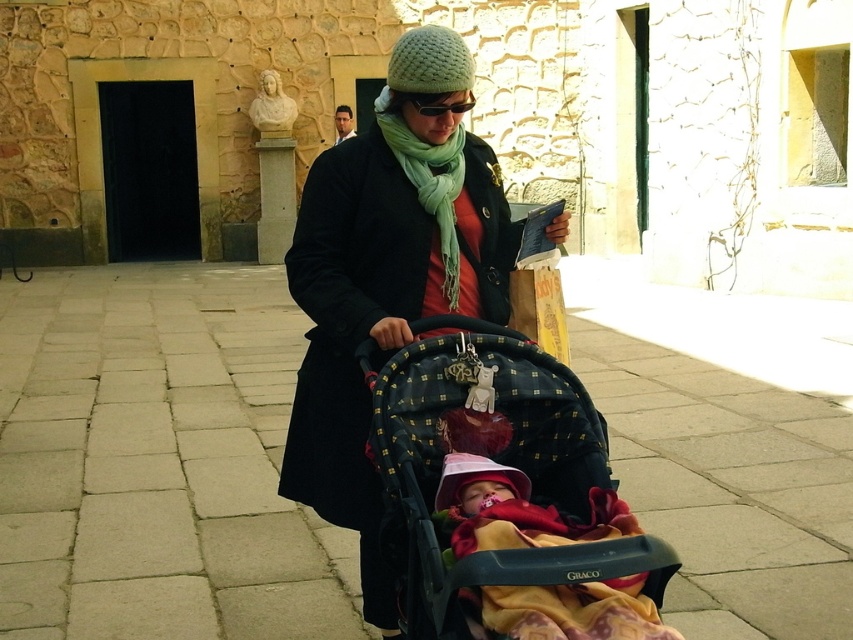
You are a photographer capturing a scene in a courtyard with a stone wall and a person pushing a stroller. You notice the matte black coat at center and the green knitted scarf at center. Which item is located more to the left?

The matte black coat at center is positioned on the left side of the green knitted scarf at center, so the matte black coat at center is more to the left.

You are a fashion designer observing the person in the matte black coat at center and green knitted scarf at center. Which clothing item has a greater width?

The matte black coat at center has a greater width than the green knitted scarf at center.